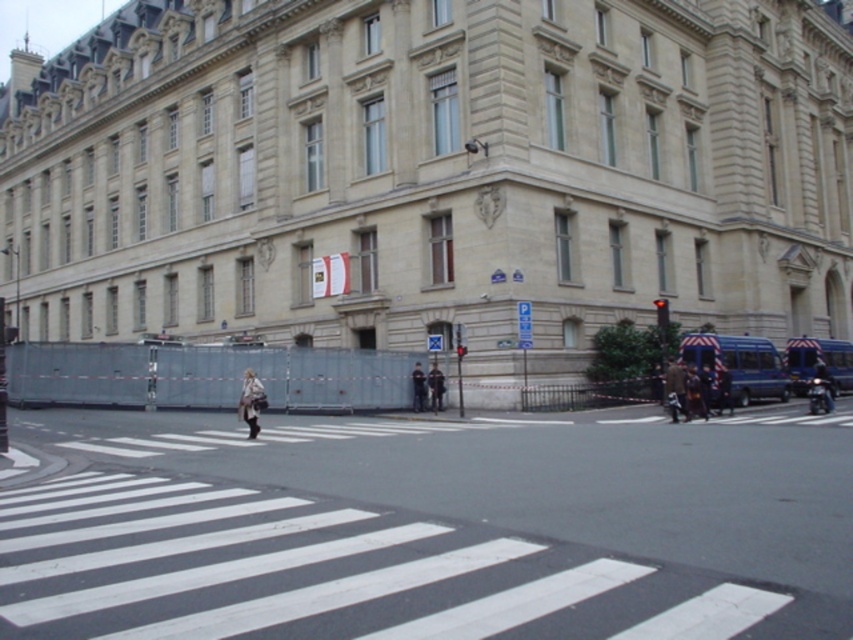
You are a fashion designer observing the street scene. You notice two jackets, the dark blue leather jacket at lower right and the brown leather jacket at center. Which jacket is wider?

The dark blue leather jacket at lower right is wider than the brown leather jacket at center because its width surpasses the latter.